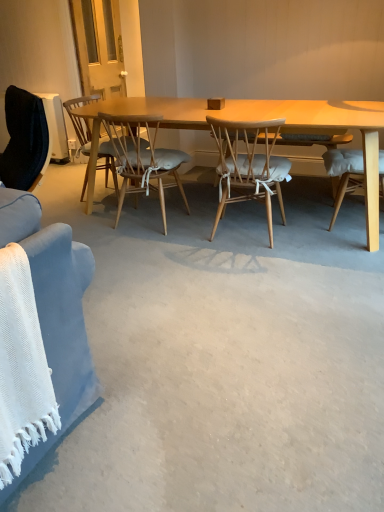
In order to click on blank space to the left of light brown woven wood chair at center, the first chair positioned from the right in this screenshot , I will do `click(180, 241)`.